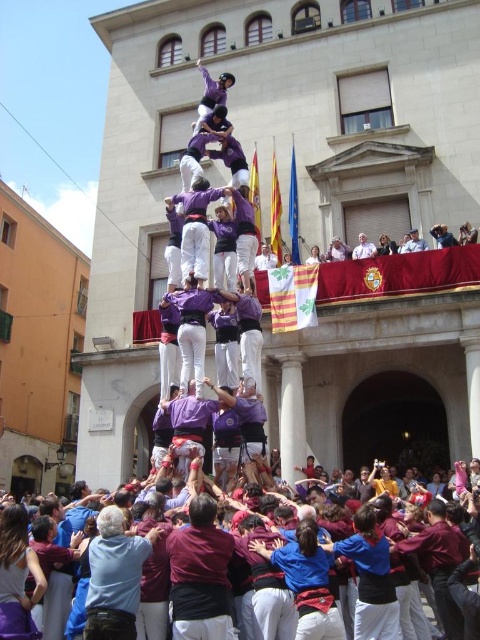
Which is more to the left, purple cotton shirt at center or light gray fabric at upper center?

From the viewer's perspective, purple cotton shirt at center appears more on the left side.

Which is in front, point (190, 428) or point (416, 250)?

Positioned in front is point (190, 428).

In order to click on purple cotton shirt at center in this screenshot , I will do `click(188, 422)`.

Which is behind, point (195, 570) or point (210, 403)?

Positioned behind is point (210, 403).

Can you confirm if maroon fabric shirt at center is bigger than purple cotton shirt at center?

Correct, maroon fabric shirt at center is larger in size than purple cotton shirt at center.

Does point (216, 540) come farther from viewer compared to point (228, 406)?

That is False.

Locate an element on the screen. maroon fabric shirt at center is located at coordinates (200, 573).

Is point (448, 545) farther from camera compared to point (158, 413)?

No, it is in front of (158, 413).

Is point (435, 500) positioned after point (179, 416)?

No, (435, 500) is closer to viewer.

Identify the location of maroon fabric crowd at lower center. (450, 618).